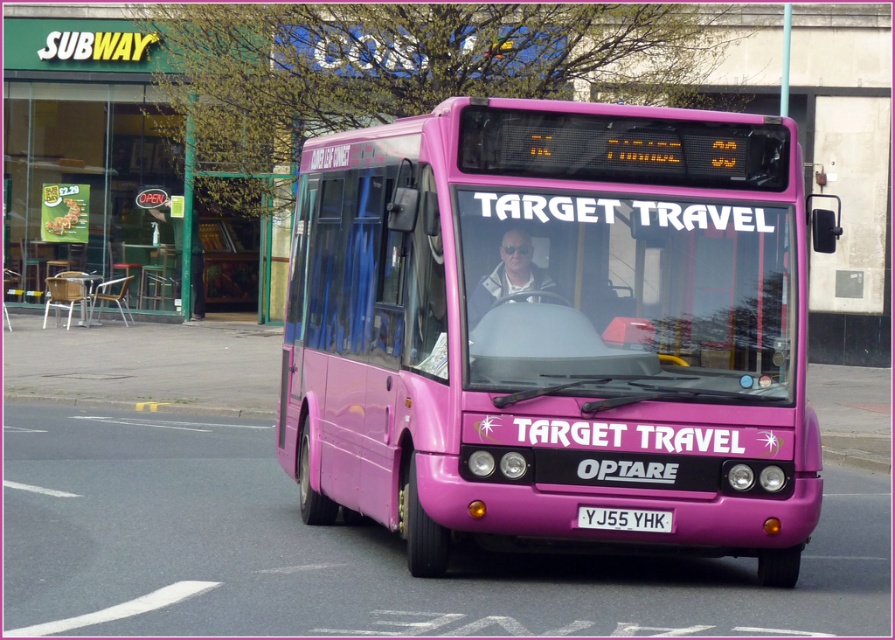
You are a delivery person who needs to attach a large package to the matte pink bus at center. The package requires a minimum of 2 meters in length to be secured properly. Can the white plastic license plate at center provide enough space for this package?

The matte pink bus at center is bigger than the white plastic license plate at center. However, the white plastic license plate at center is only about 0.5 meters in length, which is insufficient for securing the package requiring 2 meters. The package should be attached to the matte pink bus at center instead.

You are a photographer trying to capture both the matte pink bus at center and the matte black sunglasses at center in the same frame. Since both are at the center, which object should you adjust your camera angle to focus on to ensure both are visible without cropping either?

The matte pink bus at center is larger in size than matte black sunglasses at center. To ensure both are visible without cropping, adjust the camera angle to focus on the matte pink bus at center, as it requires more space in the frame due to its larger size.

You are a passenger on the pink bus and looking out the window. You see the matte black sunglasses at center and the white plastic license plate at center. Which object is closer to the left side of your view?

The matte black sunglasses at center is to the left of the white plastic license plate at center, so the matte black sunglasses at center is closer to the left side of your view.